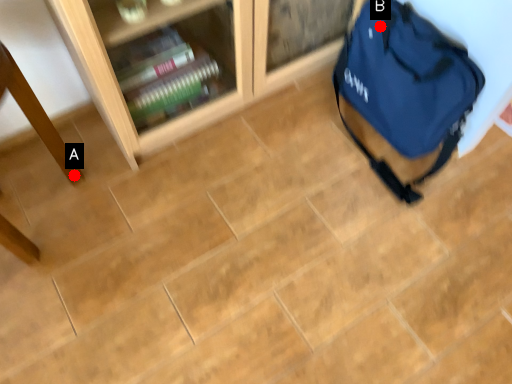
Question: Two points are circled on the image, labeled by A and B beside each circle. Which point is closer to the camera?

Choices:
 (A) A is closer
 (B) B is closer

Answer: (A)